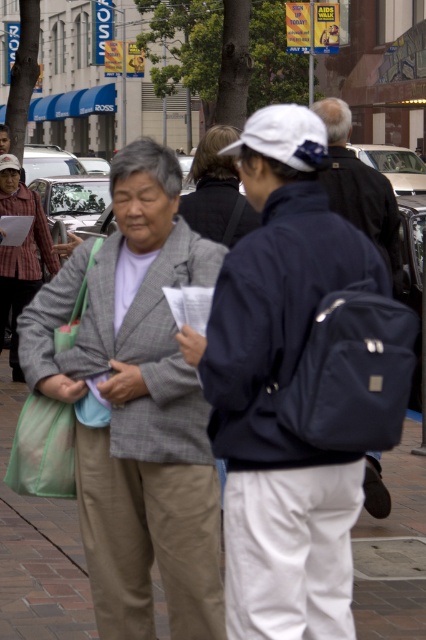
Does gray wool jacket at center lie in front of matte blue backpack at center?

Yes.

You are a GUI agent. You are given a task and a screenshot of the screen. Output one action in this format:
    pyautogui.click(x=<x>, y=<y>)
    Task: Click on the gray wool jacket at center
    
    Given the screenshot: What is the action you would take?
    pyautogui.click(x=137, y=406)

Is gray wool jacket at center to the right of dark gray sweater at center from the viewer's perspective?

Incorrect, gray wool jacket at center is not on the right side of dark gray sweater at center.

Between gray wool jacket at center and dark gray sweater at center, which one appears on the right side from the viewer's perspective?

dark gray sweater at center is more to the right.

Is point (160, 544) less distant than point (222, 161)?

Yes, it is.

The height and width of the screenshot is (640, 426). I want to click on gray wool jacket at center, so (137, 406).

Does gray wool jacket at center have a smaller size compared to plaid shirt at center?

Indeed, gray wool jacket at center has a smaller size compared to plaid shirt at center.

Where is `gray wool jacket at center`? This screenshot has height=640, width=426. gray wool jacket at center is located at coordinates (137, 406).